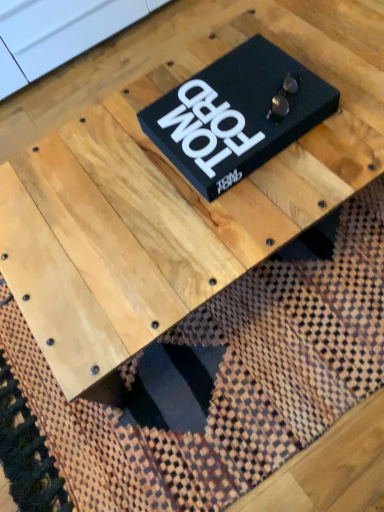
This screenshot has width=384, height=512. I want to click on free spot to the right of black matte book at center, so point(336,69).